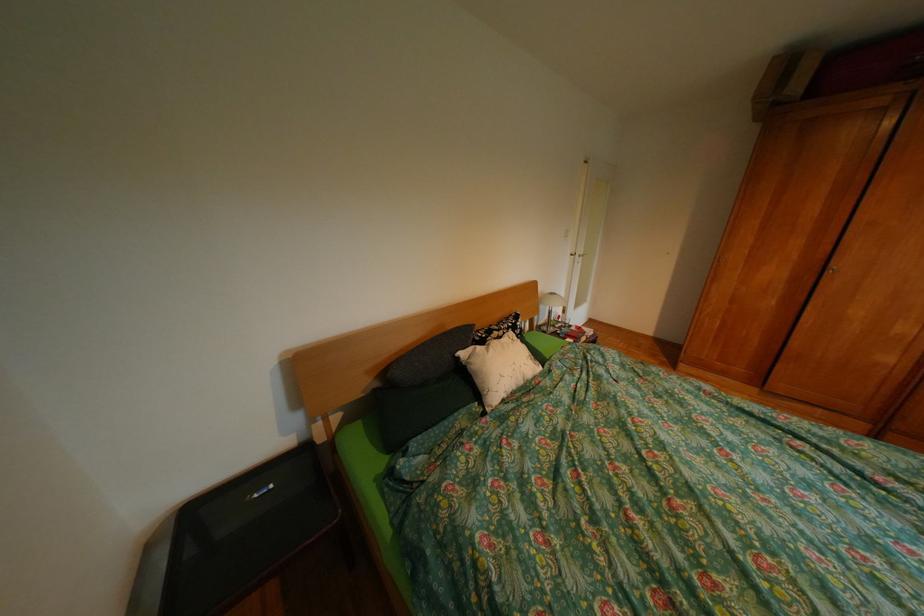
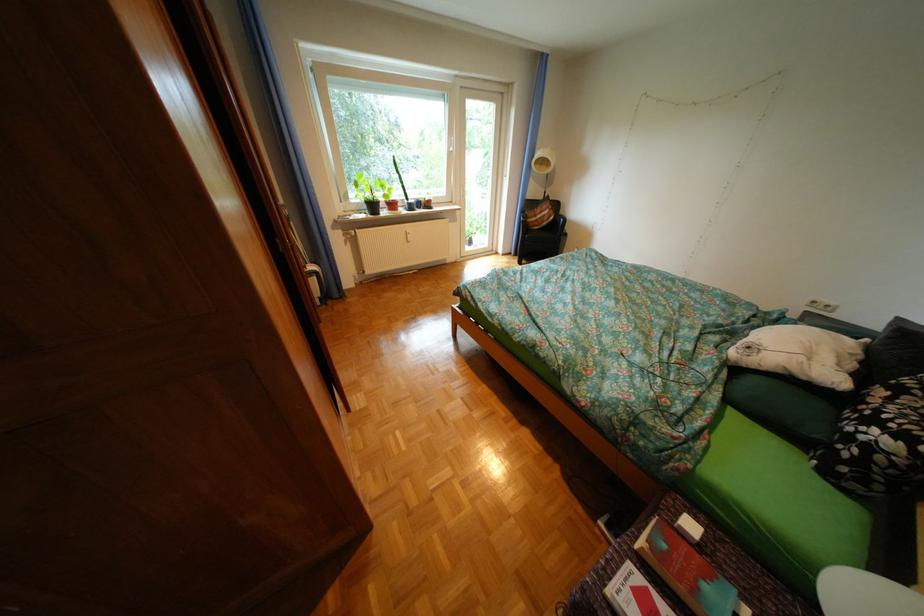
In the second image, find the point that corresponds to point 513,331 in the first image.

(904, 399)